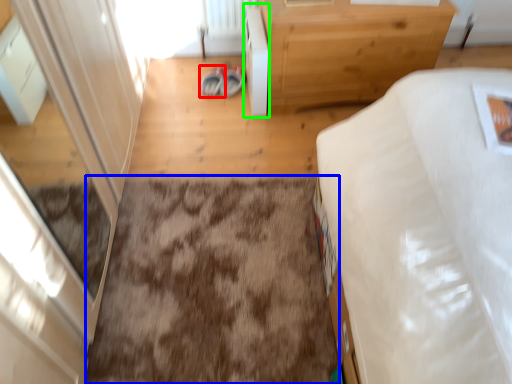
Question: Which object is the closest to the footwear (highlighted by a red box)? Choose among these: dirt (highlighted by a blue box) or cabinetry (highlighted by a green box).

Choices:
 (A) dirt
 (B) cabinetry

Answer: (B)